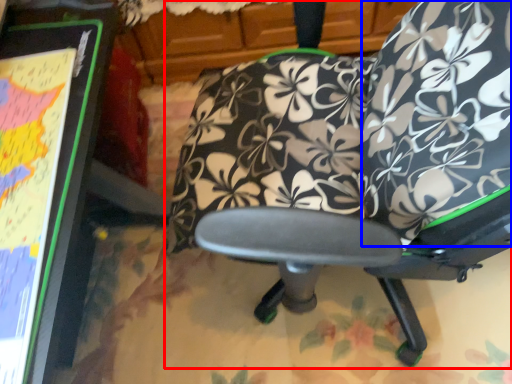
Question: Which of the following is the closest to the observer, chair (highlighted by a red box) or bean bag chair (highlighted by a blue box)?

Choices:
 (A) chair
 (B) bean bag chair

Answer: (A)